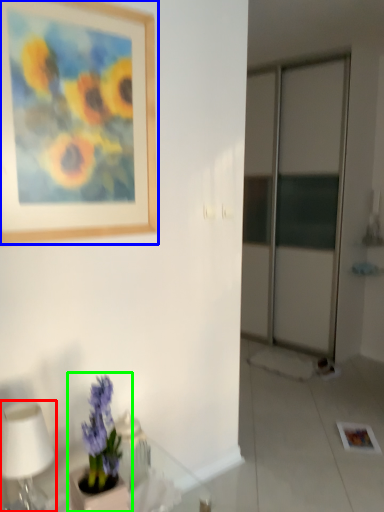
Question: Based on their relative distances, which object is farther from table lamp (highlighted by a red box)? Choose from picture frame (highlighted by a blue box) and houseplant (highlighted by a green box).

Choices:
 (A) picture frame
 (B) houseplant

Answer: (A)